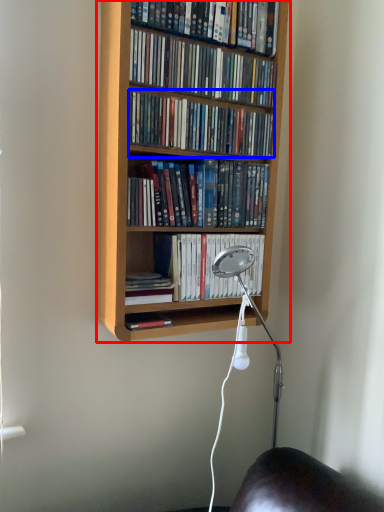
Question: Which object appears closest to the camera in this image, bookcase (highlighted by a red box) or book (highlighted by a blue box)?

Choices:
 (A) bookcase
 (B) book

Answer: (A)